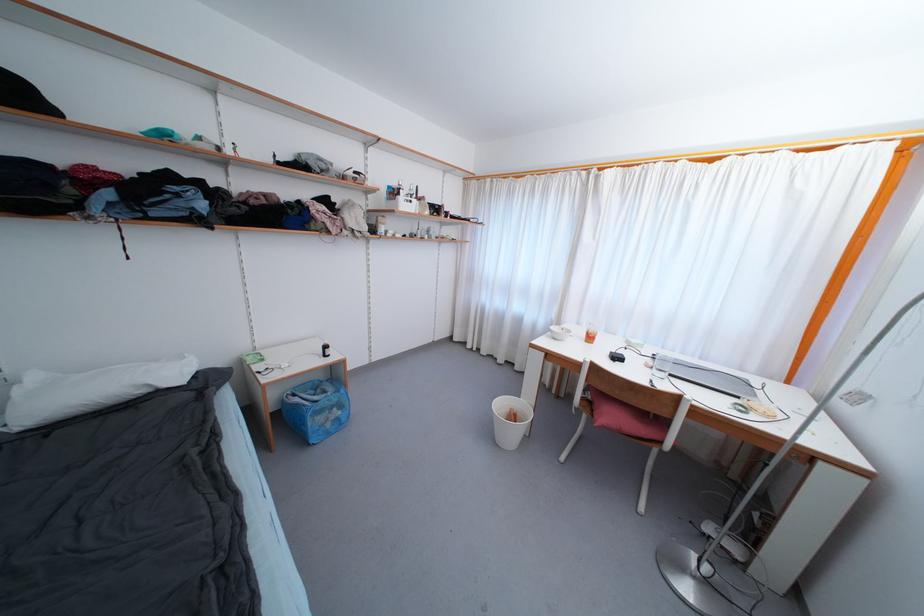
Where is `blue laundry hamper`? This screenshot has height=616, width=924. blue laundry hamper is located at coordinates (315, 408).